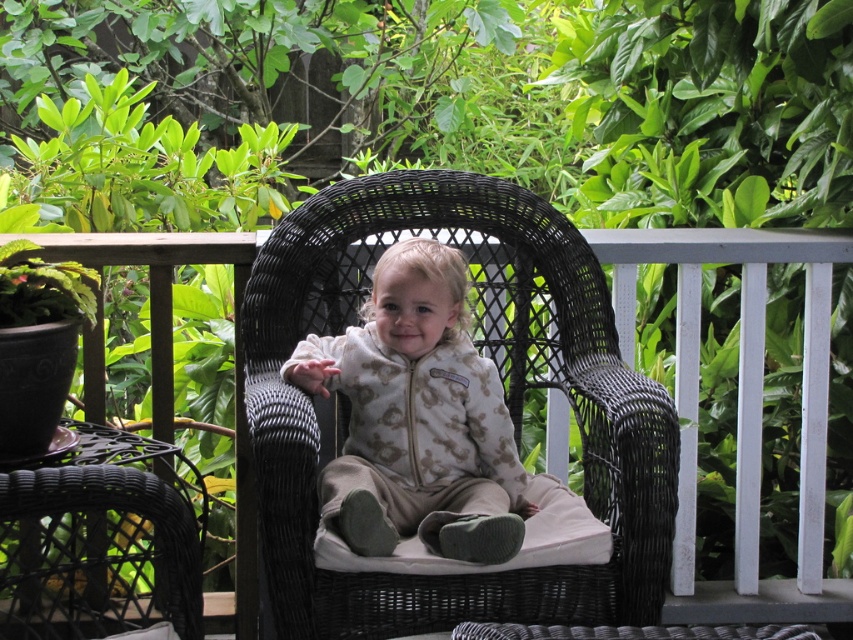
Question: Which point is farther to the camera?

Choices:
 (A) black wicker armchair at center
 (B) black wicker chair at center

Answer: (B)

Question: Is black wicker armchair at center bigger than black wicker chair at center?

Choices:
 (A) yes
 (B) no

Answer: (A)

Question: Can you confirm if black wicker armchair at center is bigger than black wicker chair at center?

Choices:
 (A) no
 (B) yes

Answer: (B)

Question: Does black wicker armchair at center have a greater width compared to black wicker chair at center?

Choices:
 (A) yes
 (B) no

Answer: (A)